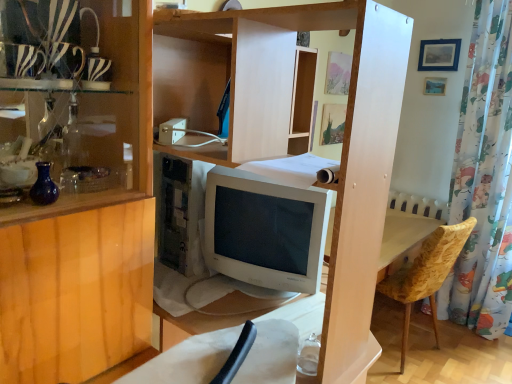
Question: From the image's perspective, is blue glass vase at left on top of blue matte picture frame at upper right?

Choices:
 (A) yes
 (B) no

Answer: (B)

Question: Considering the relative sizes of blue glass vase at left and blue matte picture frame at upper right in the image provided, is blue glass vase at left wider than blue matte picture frame at upper right?

Choices:
 (A) yes
 (B) no

Answer: (A)

Question: Considering the relative positions of blue glass vase at left and blue matte picture frame at upper right in the image provided, is blue glass vase at left to the left of blue matte picture frame at upper right from the viewer's perspective?

Choices:
 (A) yes
 (B) no

Answer: (A)

Question: Can you confirm if blue glass vase at left is thinner than blue matte picture frame at upper right?

Choices:
 (A) yes
 (B) no

Answer: (B)

Question: Is blue glass vase at left at the right side of blue matte picture frame at upper right?

Choices:
 (A) yes
 (B) no

Answer: (B)

Question: Is floral fabric shower curtain at right inside the boundaries of blue glass vase at left, or outside?

Choices:
 (A) inside
 (B) outside

Answer: (B)

Question: Based on their positions, is floral fabric shower curtain at right located to the left or right of blue glass vase at left?

Choices:
 (A) left
 (B) right

Answer: (B)

Question: From the image's perspective, is floral fabric shower curtain at right located above or below blue glass vase at left?

Choices:
 (A) above
 (B) below

Answer: (A)

Question: Considering the positions of floral fabric shower curtain at right and blue glass vase at left in the image, is floral fabric shower curtain at right wider or thinner than blue glass vase at left?

Choices:
 (A) wide
 (B) thin

Answer: (A)

Question: Considering the positions of blue matte picture frame at upper right and blue glass vase at left in the image, is blue matte picture frame at upper right wider or thinner than blue glass vase at left?

Choices:
 (A) wide
 (B) thin

Answer: (B)

Question: Is blue matte picture frame at upper right situated inside blue glass vase at left or outside?

Choices:
 (A) outside
 (B) inside

Answer: (A)

Question: Is blue matte picture frame at upper right taller or shorter than blue glass vase at left?

Choices:
 (A) short
 (B) tall

Answer: (B)

Question: From the image's perspective, relative to blue glass vase at left, is blue matte picture frame at upper right above or below?

Choices:
 (A) below
 (B) above

Answer: (B)

Question: Is zebra-patterned glass at upper left to the left or to the right of floral fabric shower curtain at right in the image?

Choices:
 (A) left
 (B) right

Answer: (A)

Question: Is zebra-patterned glass at upper left spatially inside floral fabric shower curtain at right, or outside of it?

Choices:
 (A) outside
 (B) inside

Answer: (A)